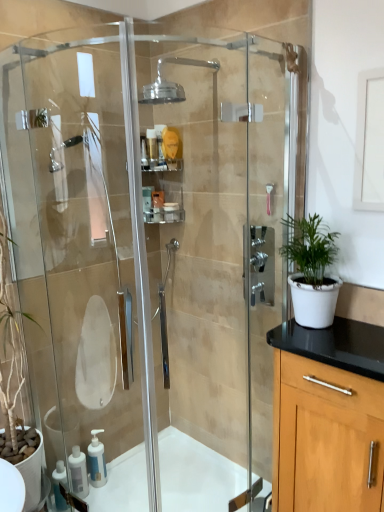
I want to click on free area below clear plastic shelf at upper center (from a real-world perspective), so click(167, 437).